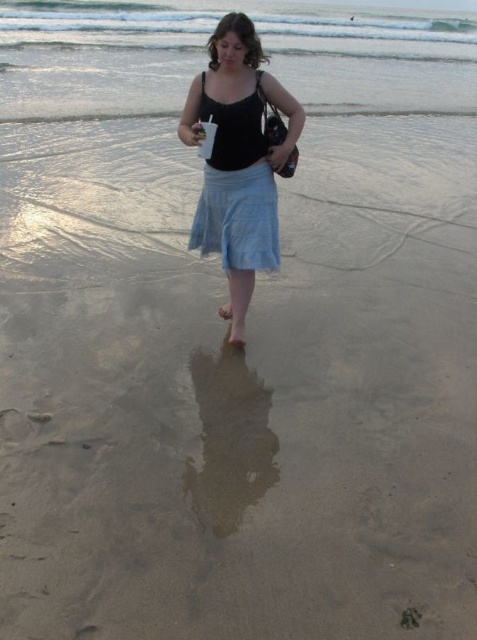
You are a photographer trying to capture the woman walking on the beach. You want to ensure that both the clear water at upper center and the light blue cotton skirt at center are visible in your shot. Based on their positions, which object should appear higher in the photo?

The clear water at upper center should appear higher in the photo because it is positioned above the light blue cotton skirt at center.

You are a photographer trying to capture the woman in the scene. Since the matte black tank top at center and the light blue cotton skirt at center are both in focus, which one appears larger in the photo?

The matte black tank top at center appears larger in the photo because it is much taller than the light blue cotton skirt at center.